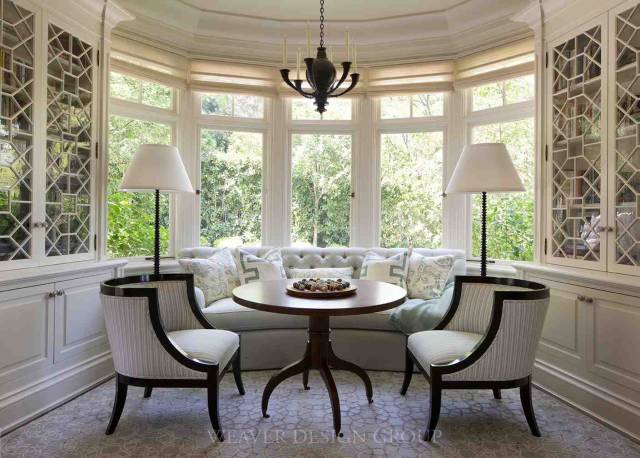
Locate an element on the screen. This screenshot has width=640, height=458. ceiling is located at coordinates (253, 14).